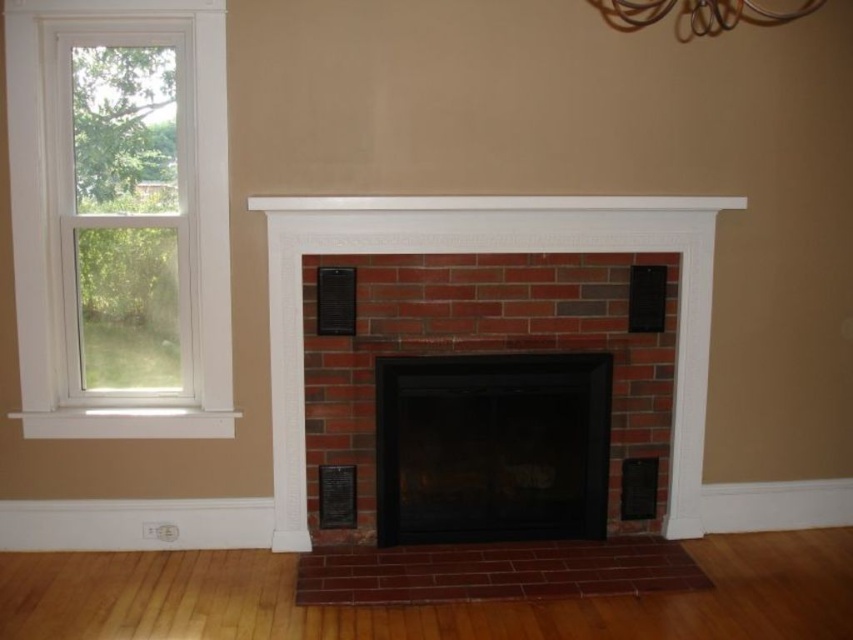
Question: Which point is farther to the camera?

Choices:
 (A) metallic wire chandelier at upper center
 (B) clear glass window at left
 (C) white painted wood mantle at upper center

Answer: (C)

Question: Does black glass fireplace at center appear over metallic wire chandelier at upper center?

Choices:
 (A) yes
 (B) no

Answer: (B)

Question: Which object is the farthest from the black glass fireplace at center?

Choices:
 (A) red brick fireplace at center
 (B) clear glass window at left

Answer: (B)

Question: Among these objects, which one is farthest from the camera?

Choices:
 (A) white painted wood mantle at upper center
 (B) metallic wire chandelier at upper center

Answer: (A)

Question: Does red brick fireplace at center come in front of black glass fireplace at center?

Choices:
 (A) no
 (B) yes

Answer: (B)

Question: Is black glass fireplace at center above metallic wire chandelier at upper center?

Choices:
 (A) no
 (B) yes

Answer: (A)